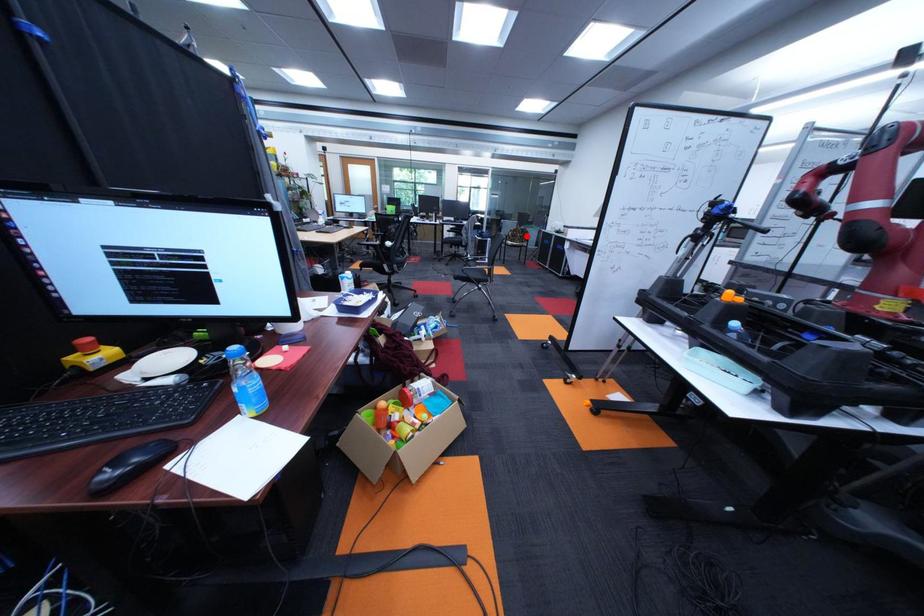
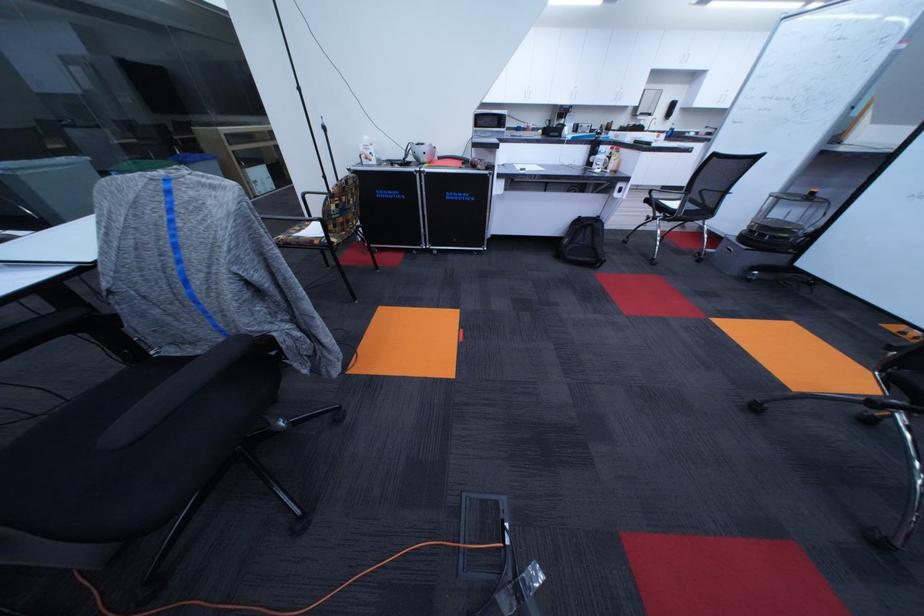
Question: A red point is marked in image1. In image2, is the corresponding 3D point closer to the camera or farther? Reply with the corresponding letter.

Choices:
 (A) The corresponding 3D point is closer.
 (B) The corresponding 3D point is farther.

Answer: (A)